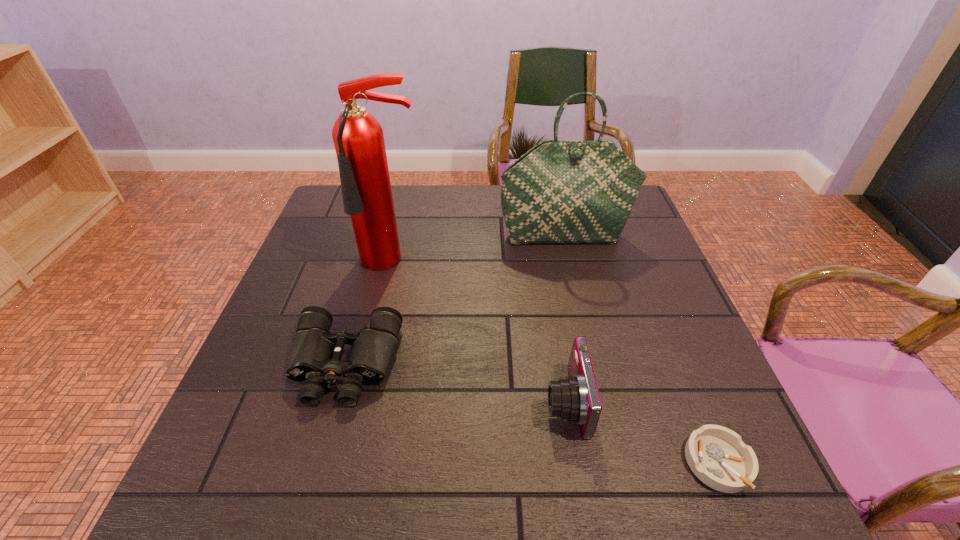
The height and width of the screenshot is (540, 960). Find the location of `vacant area at the left edge of the desktop`. vacant area at the left edge of the desktop is located at coordinates (x=284, y=296).

Find the location of a particular element. vacant space at the right edge of the desktop is located at coordinates (652, 333).

Where is `free spot between the third tallest object and the fourth shortest object`? free spot between the third tallest object and the fourth shortest object is located at coordinates (565, 319).

The image size is (960, 540). Identify the location of empty space that is in between the tote bag and the binoculars. (455, 300).

Locate an element on the screen. This screenshot has width=960, height=540. vacant space in between the shortest object and the binoculars is located at coordinates (531, 414).

At what (x,y) coordinates should I click in order to perform the action: click on vacant space in between the tote bag and the binoculars. Please return your answer as a coordinate pair (x, y). This screenshot has height=540, width=960. Looking at the image, I should click on (455, 300).

Identify the location of free area in between the fourth tallest object and the camera. (455, 383).

Locate an element on the screen. The width and height of the screenshot is (960, 540). empty space that is in between the shortest object and the camera is located at coordinates [x=641, y=432].

This screenshot has height=540, width=960. In order to click on empty space between the binoculars and the fire extinguisher in this screenshot , I will do `click(369, 314)`.

You are a GUI agent. You are given a task and a screenshot of the screen. Output one action in this format:
    pyautogui.click(x=<x>, y=<y>)
    Task: Click on the unoccupied position between the shortest object and the camera
    This screenshot has width=960, height=540.
    Given the screenshot: What is the action you would take?
    pyautogui.click(x=641, y=432)